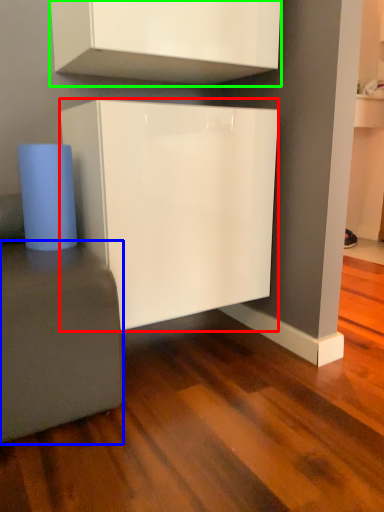
Question: Based on their relative distances, which object is nearer to cabinetry (highlighted by a red box)? Choose from furniture (highlighted by a blue box) and cabinetry (highlighted by a green box).

Choices:
 (A) furniture
 (B) cabinetry

Answer: (A)